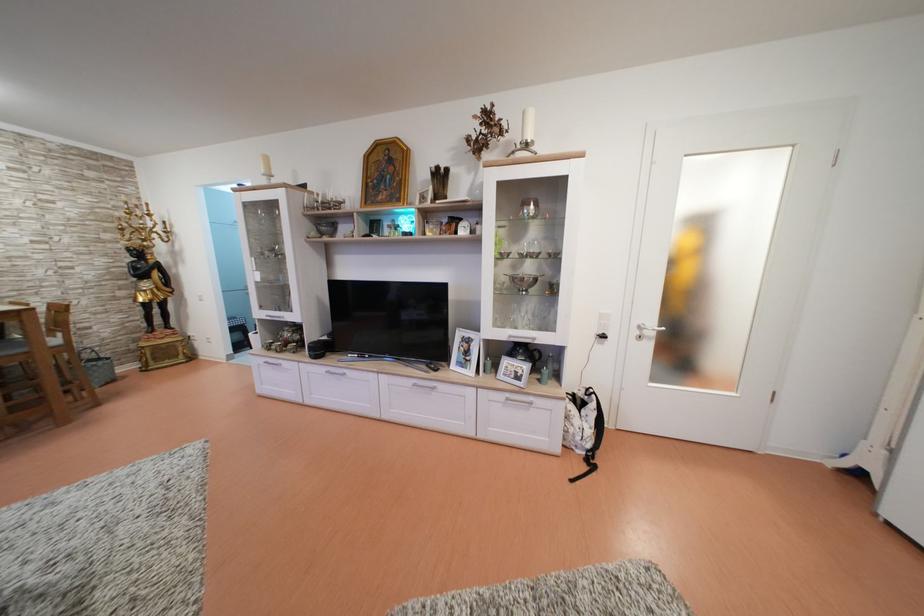
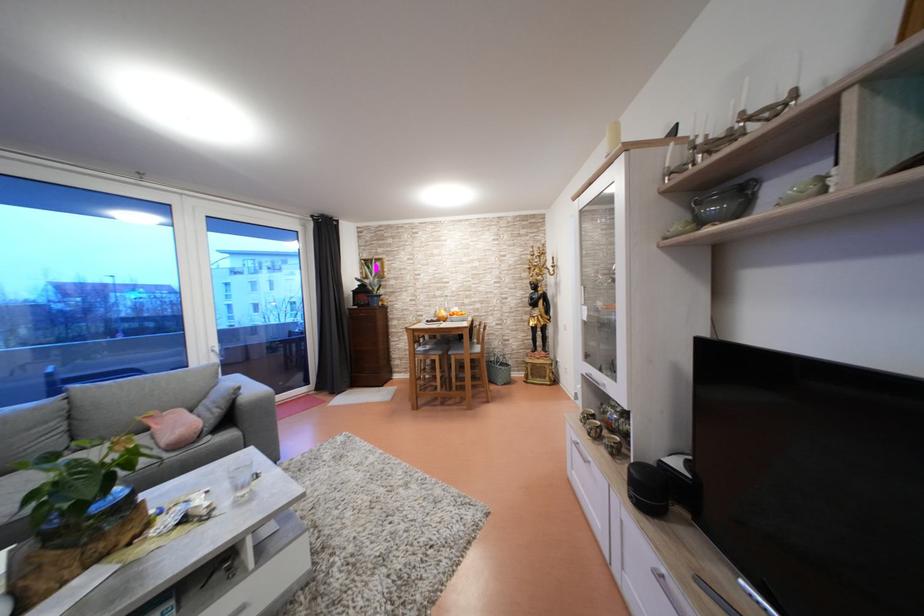
The point at (339, 225) is marked in the first image. Where is the corresponding point in the second image?

(748, 185)